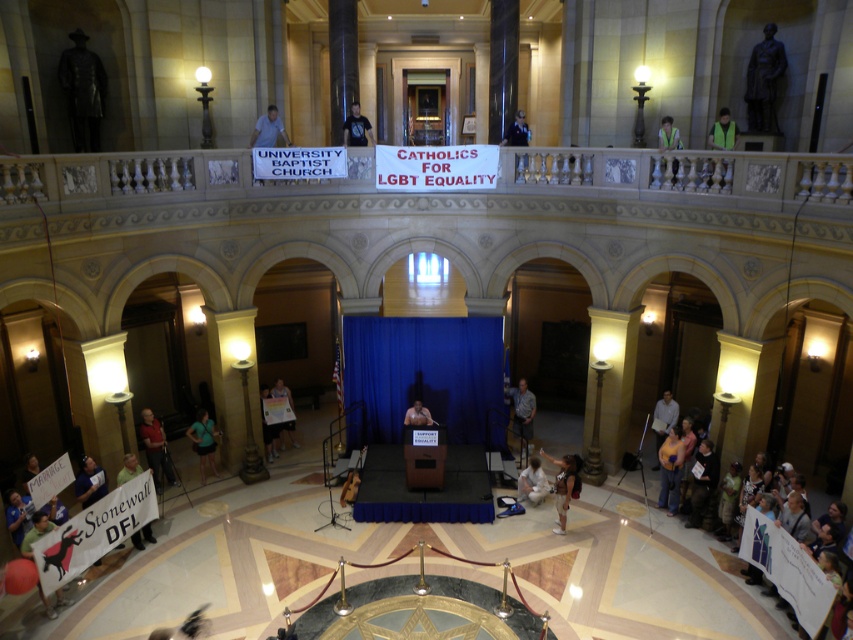
You are standing in the grand hall and want to reach a specific point marked at coordinates point (779, 51). If you are currently 40 feet away from that point, can you move forward to reach it?

The distance of point (779, 51) from viewer is 41.16 feet, so you are actually 40 feet away and still need to move 1.16 feet forward to reach it.